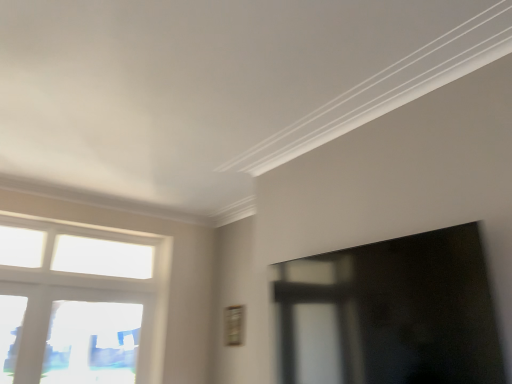
You are a GUI agent. You are given a task and a screenshot of the screen. Output one action in this format:
    pyautogui.click(x=<x>, y=<y>)
    Task: Click on the transparent glass window at lower left, placed as the 2th window when sorted from top to bottom
    The image size is (512, 384).
    Given the screenshot: What is the action you would take?
    92,342

The height and width of the screenshot is (384, 512). I want to click on transparent glass window at lower left, placed as the 2th window when sorted from top to bottom, so click(92, 342).

Measure the distance between transparent glass window at lower left, placed as the 2th window when sorted from top to bottom, and white glass window at left, which appears as the second window when ordered from the bottom.

transparent glass window at lower left, placed as the 2th window when sorted from top to bottom, is 1.65 inches away from white glass window at left, which appears as the second window when ordered from the bottom.

Which is correct: transparent glass window at lower left, acting as the first window starting from the bottom, is inside white glass window at left, which appears as the second window when ordered from the bottom, or outside of it?

transparent glass window at lower left, acting as the first window starting from the bottom, cannot be found inside white glass window at left, which appears as the second window when ordered from the bottom.

From the image's perspective, which is below, transparent glass window at lower left, acting as the first window starting from the bottom, or white glass window at left, which appears as the second window when ordered from the bottom?

transparent glass window at lower left, acting as the first window starting from the bottom.

Considering the relative positions of transparent glass window at lower left, acting as the first window starting from the bottom, and white glass window at left, arranged as the first window when viewed from the top, in the image provided, is transparent glass window at lower left, acting as the first window starting from the bottom, to the left or to the right of white glass window at left, arranged as the first window when viewed from the top,?

Clearly, transparent glass window at lower left, acting as the first window starting from the bottom, is on the right of white glass window at left, arranged as the first window when viewed from the top, in the image.

From the image's perspective, is transparent glass window at lower left, placed as the 2th window when sorted from top to bottom, positioned above or below transparent glass window screen at right?

Clearly, from the image's perspective, transparent glass window at lower left, placed as the 2th window when sorted from top to bottom, is below transparent glass window screen at right.

Which object is further away from the camera, transparent glass window at lower left, acting as the first window starting from the bottom, or transparent glass window screen at right?

transparent glass window at lower left, acting as the first window starting from the bottom, is further away from the camera.

From a real-world perspective, is transparent glass window at lower left, placed as the 2th window when sorted from top to bottom, beneath transparent glass window screen at right?

Correct, in the physical world, transparent glass window at lower left, placed as the 2th window when sorted from top to bottom, is lower than transparent glass window screen at right.

Between transparent glass window at lower left, placed as the 2th window when sorted from top to bottom, and transparent glass window screen at right, which one has smaller width?

With smaller width is transparent glass window at lower left, placed as the 2th window when sorted from top to bottom.

Consider the image. Is transparent glass window screen at right located outside transparent glass window at lower left, acting as the first window starting from the bottom?

Absolutely, transparent glass window screen at right is external to transparent glass window at lower left, acting as the first window starting from the bottom.

How different are the orientations of transparent glass window screen at right and transparent glass window at lower left, acting as the first window starting from the bottom, in degrees?

89.2 degrees separate the facing orientations of transparent glass window screen at right and transparent glass window at lower left, acting as the first window starting from the bottom.

Can you confirm if transparent glass window screen at right is smaller than transparent glass window at lower left, placed as the 2th window when sorted from top to bottom?

No.

Is there a large distance between transparent glass window screen at right and transparent glass window at lower left, acting as the first window starting from the bottom?

That's right, there is a large distance between transparent glass window screen at right and transparent glass window at lower left, acting as the first window starting from the bottom.

Which of these two, white glass window at left, arranged as the first window when viewed from the top, or transparent glass window screen at right, stands taller?

white glass window at left, arranged as the first window when viewed from the top, is taller.

Is white glass window at left, which appears as the second window when ordered from the bottom, in contact with transparent glass window screen at right?

No.

Considering the sizes of objects white glass window at left, arranged as the first window when viewed from the top, and transparent glass window screen at right in the image provided, who is wider, white glass window at left, arranged as the first window when viewed from the top, or transparent glass window screen at right?

With larger width is transparent glass window screen at right.

Which object is positioned more to the left, white glass window at left, which appears as the second window when ordered from the bottom, or transparent glass window screen at right?

white glass window at left, which appears as the second window when ordered from the bottom, is more to the left.

Which of these two, white glass window at left, which appears as the second window when ordered from the bottom, or transparent glass window at lower left, acting as the first window starting from the bottom, stands shorter?

With less height is transparent glass window at lower left, acting as the first window starting from the bottom.

Considering the positions of objects white glass window at left, which appears as the second window when ordered from the bottom, and transparent glass window at lower left, acting as the first window starting from the bottom, in the image provided, who is more to the left, white glass window at left, which appears as the second window when ordered from the bottom, or transparent glass window at lower left, acting as the first window starting from the bottom,?

white glass window at left, which appears as the second window when ordered from the bottom, is more to the left.

From a real-world perspective, between white glass window at left, arranged as the first window when viewed from the top, and transparent glass window at lower left, acting as the first window starting from the bottom, who is vertically lower?

transparent glass window at lower left, acting as the first window starting from the bottom, is physically lower.

You are a GUI agent. You are given a task and a screenshot of the screen. Output one action in this format:
    pyautogui.click(x=<x>, y=<y>)
    Task: Click on the window in front of the transparent glass window at lower left, acting as the first window starting from the bottom
    This screenshot has width=512, height=384.
    Given the screenshot: What is the action you would take?
    pyautogui.click(x=80, y=303)

From a real-world perspective, is transparent glass window screen at right positioned above or below white glass window at left, arranged as the first window when viewed from the top?

Clearly, from a real-world perspective, transparent glass window screen at right is below white glass window at left, arranged as the first window when viewed from the top.

Between transparent glass window screen at right and white glass window at left, which appears as the second window when ordered from the bottom, which one has smaller size?

With smaller size is white glass window at left, which appears as the second window when ordered from the bottom.

Is the surface of transparent glass window screen at right in direct contact with white glass window at left, arranged as the first window when viewed from the top?

transparent glass window screen at right and white glass window at left, arranged as the first window when viewed from the top, are not in contact.

The height and width of the screenshot is (384, 512). In the image, there is a transparent glass window at lower left, placed as the 2th window when sorted from top to bottom. What are the coordinates of `window above it (from the image's perspective)` in the screenshot? It's located at (80, 303).

Where is `window screen in front of the transparent glass window at lower left, acting as the first window starting from the bottom`? The image size is (512, 384). window screen in front of the transparent glass window at lower left, acting as the first window starting from the bottom is located at coordinates (390, 313).

Looking at the image, which one is located further to white glass window at left, which appears as the second window when ordered from the bottom, transparent glass window screen at right or transparent glass window at lower left, acting as the first window starting from the bottom?

transparent glass window screen at right lies further to white glass window at left, which appears as the second window when ordered from the bottom, than the other object.

Considering their positions, is white glass window at left, which appears as the second window when ordered from the bottom, positioned closer to transparent glass window at lower left, acting as the first window starting from the bottom, than transparent glass window screen at right?

Among the two, white glass window at left, which appears as the second window when ordered from the bottom, is located nearer to transparent glass window at lower left, acting as the first window starting from the bottom.

Which object lies nearer to the anchor point transparent glass window at lower left, acting as the first window starting from the bottom, transparent glass window screen at right or white glass window at left, arranged as the first window when viewed from the top?

Among the two, white glass window at left, arranged as the first window when viewed from the top, is located nearer to transparent glass window at lower left, acting as the first window starting from the bottom.

From the image, which object appears to be nearer to transparent glass window screen at right, white glass window at left, which appears as the second window when ordered from the bottom, or transparent glass window at lower left, placed as the 2th window when sorted from top to bottom?

transparent glass window at lower left, placed as the 2th window when sorted from top to bottom, is positioned closer to the anchor transparent glass window screen at right.

When comparing their distances from white glass window at left, which appears as the second window when ordered from the bottom, does transparent glass window at lower left, acting as the first window starting from the bottom, or transparent glass window screen at right seem further?

The object further to white glass window at left, which appears as the second window when ordered from the bottom, is transparent glass window screen at right.

Based on their spatial positions, is transparent glass window at lower left, placed as the 2th window when sorted from top to bottom, or white glass window at left, arranged as the first window when viewed from the top, further from transparent glass window screen at right?

The object further to transparent glass window screen at right is white glass window at left, arranged as the first window when viewed from the top.

Identify the location of window located between white glass window at left, arranged as the first window when viewed from the top, and transparent glass window screen at right in the left-right direction. The height and width of the screenshot is (384, 512). (92, 342).